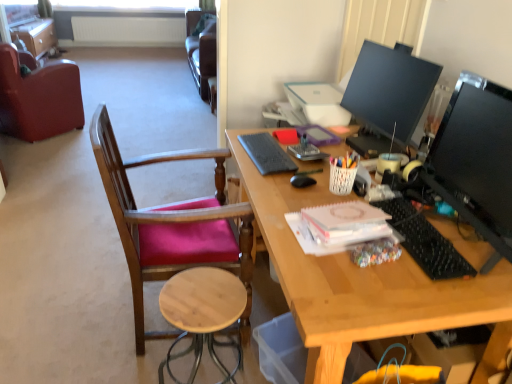
You are a GUI agent. You are given a task and a screenshot of the screen. Output one action in this format:
    pyautogui.click(x=<x>, y=<y>)
    Task: Click on the empty space that is ontop of pink paper notepad at center, arranged as the 1th notepad when ordered from the bottom (from a real-world perspective)
    
    Given the screenshot: What is the action you would take?
    pyautogui.click(x=351, y=215)